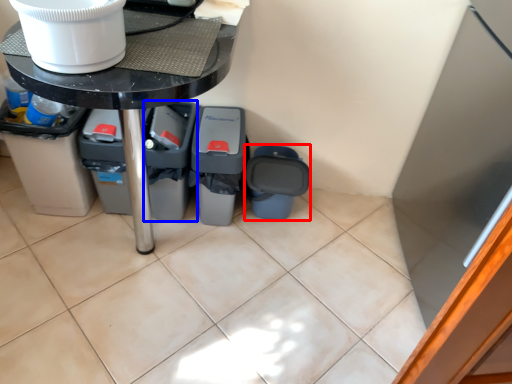
Question: Which of the following is the closest to the observer, recycling bin (highlighted by a red box) or recycling bin (highlighted by a blue box)?

Choices:
 (A) recycling bin
 (B) recycling bin

Answer: (B)